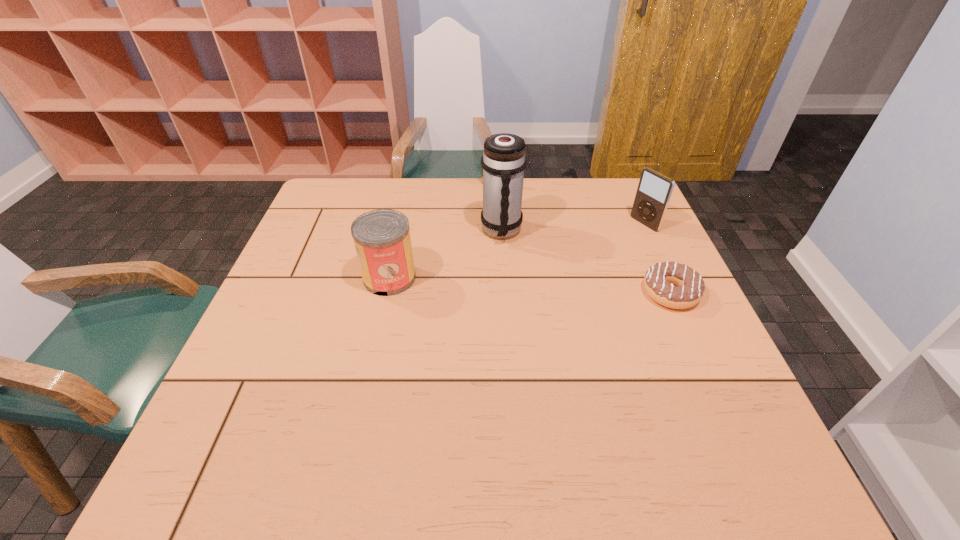
I want to click on free space between the iPod and the tallest object, so click(573, 227).

Find the location of a particular element. This screenshot has width=960, height=540. unoccupied area between the thermos bottle and the can is located at coordinates (445, 254).

At what (x,y) coordinates should I click in order to perform the action: click on vacant area between the farthest object and the iPod. Please return your answer as a coordinate pair (x, y). The image size is (960, 540). Looking at the image, I should click on coord(569,203).

The image size is (960, 540). What are the coordinates of `free point between the tallest object and the leftmost object` in the screenshot? It's located at (445, 254).

The height and width of the screenshot is (540, 960). What are the coordinates of `free space between the iPod and the thermos bottle` in the screenshot? It's located at (573, 227).

You are a GUI agent. You are given a task and a screenshot of the screen. Output one action in this format:
    pyautogui.click(x=<x>, y=<y>)
    Task: Click on the free space between the tallest object and the doughnut
    
    Given the screenshot: What is the action you would take?
    pyautogui.click(x=586, y=262)

Identify the location of free space between the tallest object and the shortest object. (586, 262).

Identify the location of object that is the second nearest to the farthest object. Image resolution: width=960 pixels, height=540 pixels. (654, 191).

Locate an element on the screen. the second closest object relative to the iPod is located at coordinates (503, 161).

Where is `vacant space that satisfies the following two spatial constraints: 1. on the front side of the leftmost object; 2. on the right side of the doughnut`? vacant space that satisfies the following two spatial constraints: 1. on the front side of the leftmost object; 2. on the right side of the doughnut is located at coordinates (386, 293).